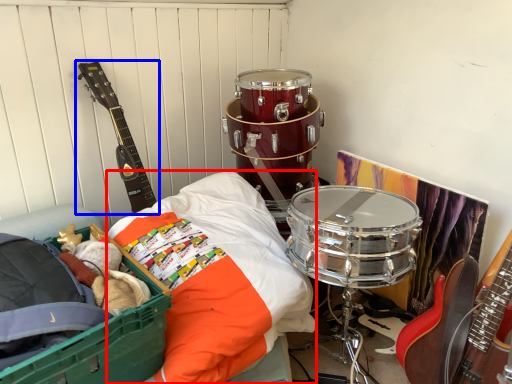
Question: Which point is further to the camera, sheet (highlighted by a red box) or guitar (highlighted by a blue box)?

Choices:
 (A) sheet
 (B) guitar

Answer: (B)